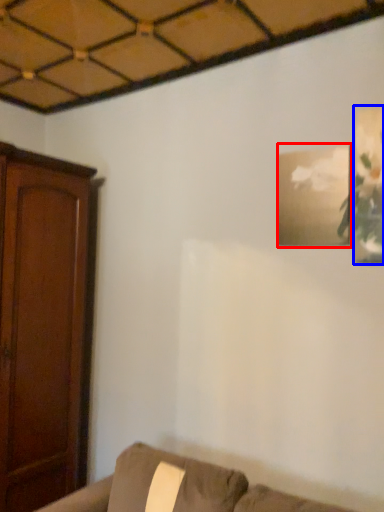
Question: Which of the following is the closest to the observer, picture frame (highlighted by a red box) or picture frame (highlighted by a blue box)?

Choices:
 (A) picture frame
 (B) picture frame

Answer: (B)